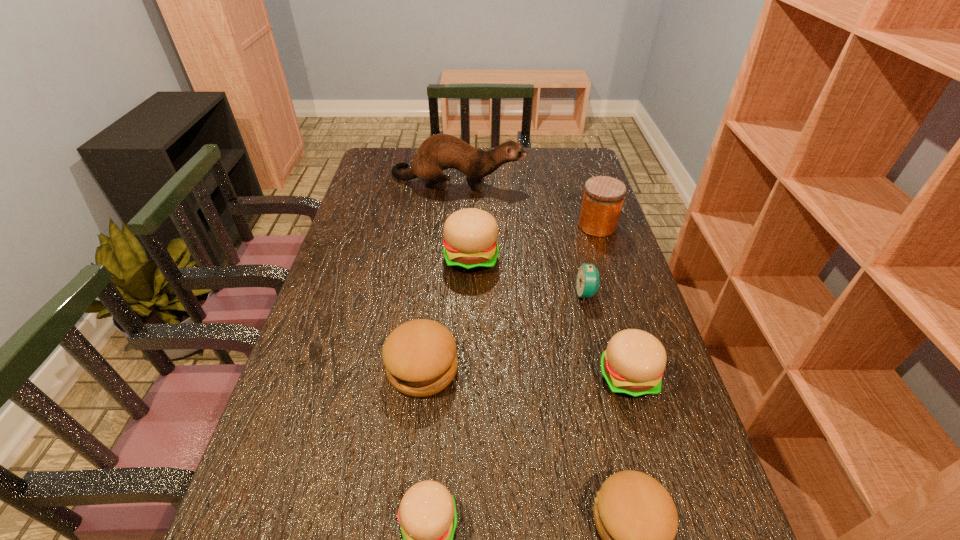
Locate an element on the screen. The image size is (960, 540). brown ferret is located at coordinates (438, 152).

I want to click on ferret, so click(x=438, y=152).

Where is `the seventh nearest object`? the seventh nearest object is located at coordinates pos(603,197).

The width and height of the screenshot is (960, 540). I want to click on jar, so click(603, 197).

I want to click on the biggest beige hamburger, so click(470, 243).

Where is `the tallest hamburger`? This screenshot has width=960, height=540. the tallest hamburger is located at coordinates (470, 243).

Locate an element on the screen. the second nearest beige hamburger is located at coordinates (632, 365).

This screenshot has height=540, width=960. What are the coordinates of `the rightmost beige hamburger` in the screenshot? It's located at (632, 365).

Find the location of a particular element. the bigger brown hamburger is located at coordinates (420, 357).

At what (x,y) coordinates should I click in order to perform the action: click on the farther brown hamburger. Please return your answer as a coordinate pair (x, y). This screenshot has height=540, width=960. Looking at the image, I should click on (420, 357).